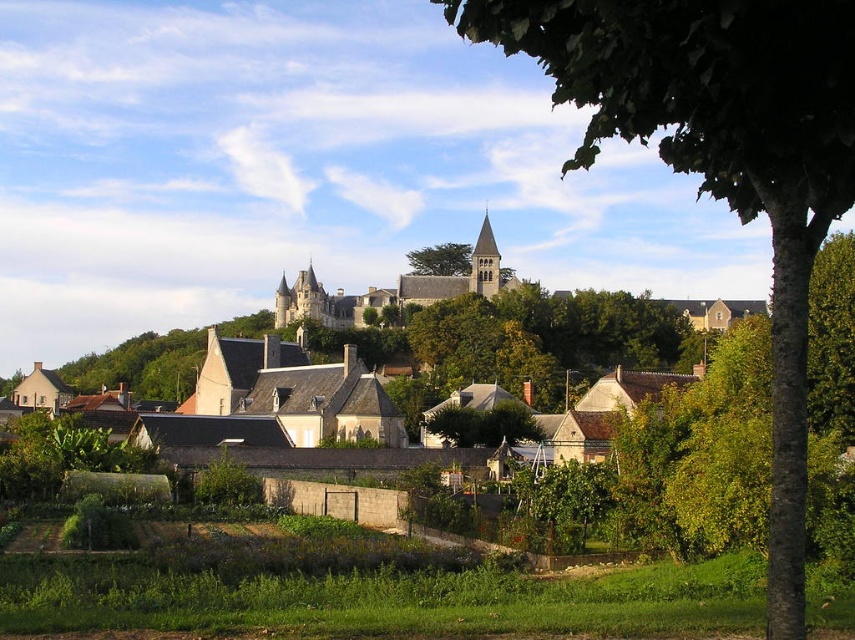
Does stone castle at center have a larger size compared to green leafy tree at center?

Indeed, stone castle at center has a larger size compared to green leafy tree at center.

Identify the location of stone castle at center. (391, 289).

Between point (298, 316) and point (466, 260), which one is positioned behind?

Point (466, 260)

Find the location of a particular element. The height and width of the screenshot is (640, 855). stone castle at center is located at coordinates (391, 289).

Does green leafy tree at upper right appear on the left side of stone castle at center?

In fact, green leafy tree at upper right is to the right of stone castle at center.

Who is positioned more to the right, green leafy tree at upper right or stone castle at center?

green leafy tree at upper right is more to the right.

Who is more forward, (756, 113) or (279, 321)?

Point (756, 113)

Where is `green leafy tree at upper right`? green leafy tree at upper right is located at coordinates coord(718,157).

Who is lower down, green leafy tree at upper right or green leafy tree at center?

green leafy tree at center

Where is `green leafy tree at upper right`? The width and height of the screenshot is (855, 640). green leafy tree at upper right is located at coordinates (718, 157).

The height and width of the screenshot is (640, 855). Find the location of `green leafy tree at upper right`. green leafy tree at upper right is located at coordinates (718, 157).